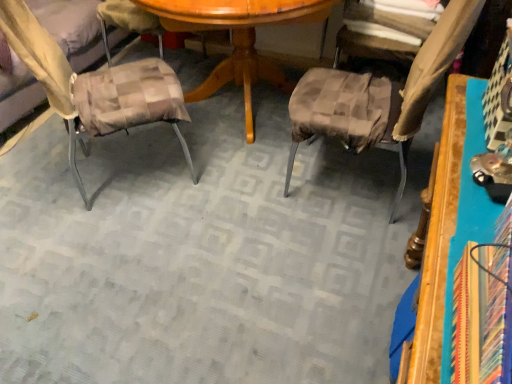
Question: Choose the correct answer: Is brown checkered cushion at center, placed as the 1th chair when sorted from right to left, inside plaid fabric cushion at left, the second chair from the right, or outside it?

Choices:
 (A) inside
 (B) outside

Answer: (B)

Question: Is brown checkered cushion at center, the second chair from the left, wider or thinner than plaid fabric cushion at left, the 1th chair positioned from the left?

Choices:
 (A) thin
 (B) wide

Answer: (A)

Question: Which is nearer to the brown checkered cushion at center, the second chair from the left?

Choices:
 (A) plaid fabric cushion at left, the 1th chair positioned from the left
 (B) brown textured fabric at upper right
 (C) wooden table at right

Answer: (B)

Question: Based on their relative distances, which object is nearer to the brown checkered cushion at center, the second chair from the left?

Choices:
 (A) plaid fabric cushion at left, the 1th chair positioned from the left
 (B) brown textured fabric at upper right
 (C) wooden table at right

Answer: (B)